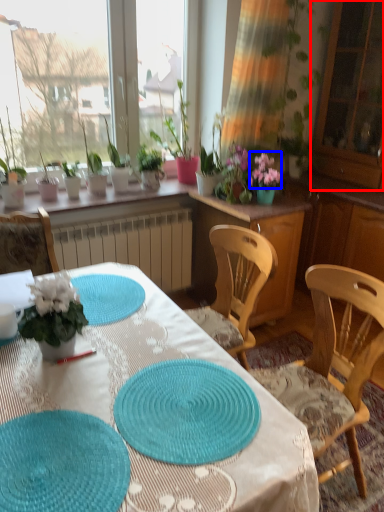
Question: Among these objects, which one is farthest to the camera, screen door (highlighted by a red box) or flower (highlighted by a blue box)?

Choices:
 (A) screen door
 (B) flower

Answer: (B)